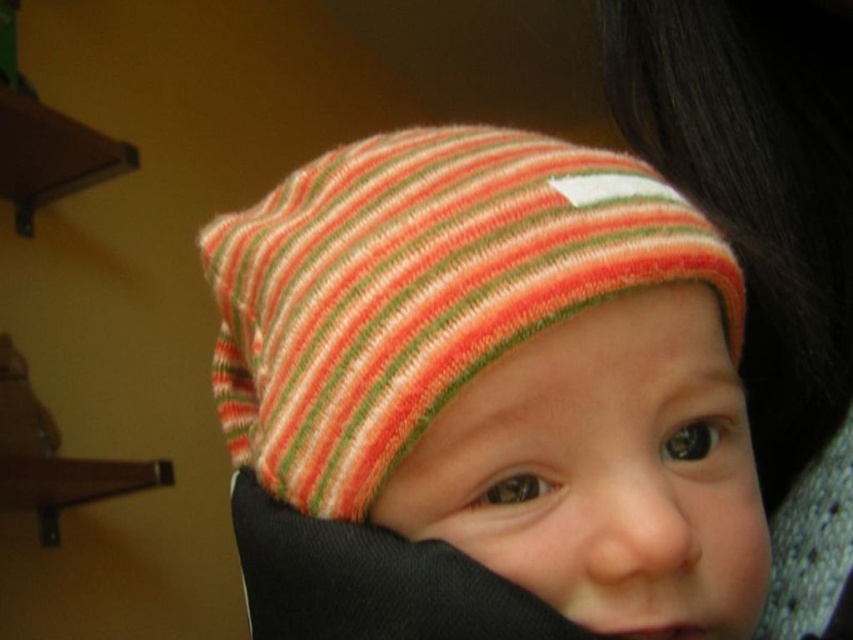
Question: Observing the image, what is the correct spatial positioning of striped knit hat at center in reference to striped knit hat at upper center?

Choices:
 (A) right
 (B) left

Answer: (B)

Question: Which object appears farthest from the camera in this image?

Choices:
 (A) striped knit hat at center
 (B) striped knit hat at upper center

Answer: (B)

Question: Can you confirm if striped knit hat at center is positioned to the right of striped knit hat at upper center?

Choices:
 (A) no
 (B) yes

Answer: (A)

Question: Among these objects, which one is nearest to the camera?

Choices:
 (A) striped knit hat at upper center
 (B) striped knit hat at center

Answer: (B)

Question: From the image, what is the correct spatial relationship of striped knit hat at center in relation to striped knit hat at upper center?

Choices:
 (A) right
 (B) left

Answer: (B)